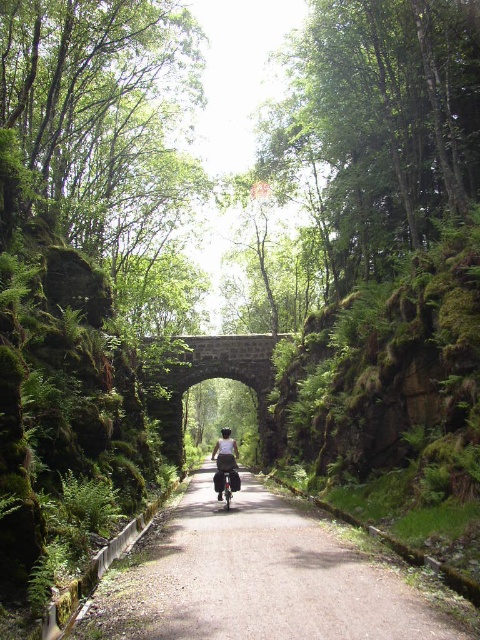
Question: In this image, where is gravel road at center located relative to stone archway at center?

Choices:
 (A) below
 (B) above

Answer: (A)

Question: Is gravel road at center thinner than stone archway at center?

Choices:
 (A) yes
 (B) no

Answer: (A)

Question: Which is nearer to the white fabric shirt at center?

Choices:
 (A) stone archway at center
 (B) gravel road at center

Answer: (B)

Question: Based on their relative distances, which object is nearer to the gravel road at center?

Choices:
 (A) stone archway at center
 (B) white fabric shirt at center

Answer: (B)

Question: Is gravel road at center thinner than white fabric shirt at center?

Choices:
 (A) yes
 (B) no

Answer: (B)

Question: Which of the following is the farthest from the observer?

Choices:
 (A) (199, 554)
 (B) (227, 442)

Answer: (B)